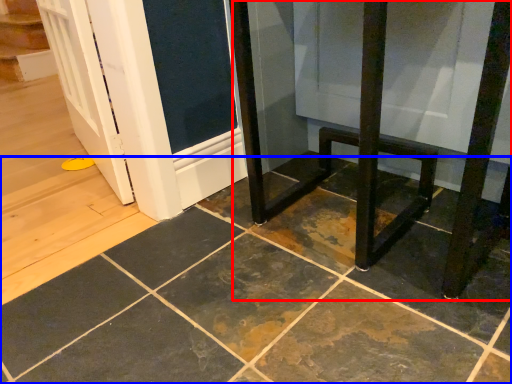
Question: Which object is further to the camera taking this photo, furniture (highlighted by a red box) or ceramic tile (highlighted by a blue box)?

Choices:
 (A) furniture
 (B) ceramic tile

Answer: (A)